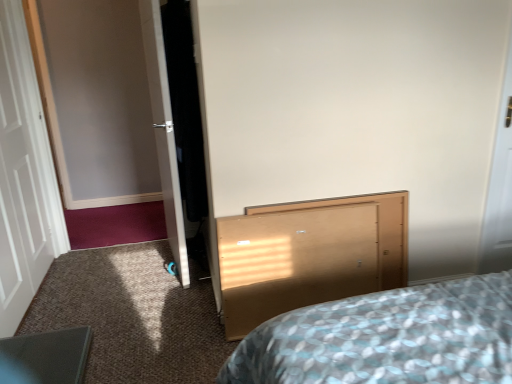
Question: In terms of height, does light wood vanity at center look taller or shorter compared to white glossy door at left, the first door from the right?

Choices:
 (A) short
 (B) tall

Answer: (A)

Question: Is point (325, 226) positioned closer to the camera than point (153, 23)?

Choices:
 (A) farther
 (B) closer

Answer: (B)

Question: Which object is positioned closest to the light wood vanity at center?

Choices:
 (A) white wooden door at left, arranged as the 1th door when viewed from the left
 (B) white glossy door at left, the first door from the right

Answer: (B)

Question: Estimate the real-world distances between objects in this image. Which object is closer to the light wood vanity at center?

Choices:
 (A) white glossy door at left, the first door from the right
 (B) white wooden door at left, arranged as the 1th door when viewed from the left

Answer: (A)